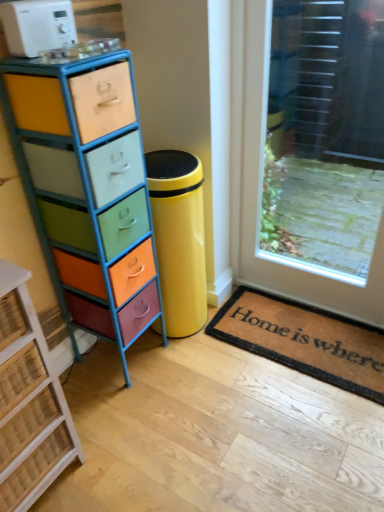
Image resolution: width=384 pixels, height=512 pixels. What do you see at coordinates (87, 189) in the screenshot?
I see `multicolored painted wood chest of drawers at left, which is the 1th chest of drawers from right to left` at bounding box center [87, 189].

This screenshot has width=384, height=512. Find the location of `brown coir mat at lower right`. brown coir mat at lower right is located at coordinates (304, 340).

Describe the element at coordinates (38, 26) in the screenshot. I see `white plastic microwave at upper left` at that location.

You are a GUI agent. You are given a task and a screenshot of the screen. Output one action in this format:
    pyautogui.click(x=<x>, y=<y>)
    Task: Click on the white plastic microwave at upper left
    This screenshot has width=384, height=512.
    Given the screenshot: What is the action you would take?
    pyautogui.click(x=38, y=26)

The width and height of the screenshot is (384, 512). Describe the element at coordinates (260, 203) in the screenshot. I see `transparent glass door at upper right` at that location.

Image resolution: width=384 pixels, height=512 pixels. In order to click on multicolored painted wood chest of drawers at left, which is the 1th chest of drawers from right to left in this screenshot , I will do `click(87, 189)`.

Who is bigger, multicolored painted wood chest of drawers at left, which is the 1th chest of drawers from right to left, or rustic wicker chest of drawers at left, which is the 1th chest of drawers in left-to-right order?

multicolored painted wood chest of drawers at left, which is the 1th chest of drawers from right to left.

Looking at this image, is multicolored painted wood chest of drawers at left, which is the second chest of drawers in left-to-right order, thinner than rustic wicker chest of drawers at left, the second chest of drawers from the right?

Yes, multicolored painted wood chest of drawers at left, which is the second chest of drawers in left-to-right order, is thinner than rustic wicker chest of drawers at left, the second chest of drawers from the right.

Locate an element on the screen. The height and width of the screenshot is (512, 384). the chest of drawers that is above the rustic wicker chest of drawers at left, which is the 1th chest of drawers in left-to-right order (from a real-world perspective) is located at coordinates (87, 189).

Does multicolored painted wood chest of drawers at left, which is the second chest of drawers in left-to-right order, turn towards rustic wicker chest of drawers at left, the second chest of drawers from the right?

No, multicolored painted wood chest of drawers at left, which is the second chest of drawers in left-to-right order, does not turn towards rustic wicker chest of drawers at left, the second chest of drawers from the right.

In the scene shown: Is rustic wicker chest of drawers at left, the second chest of drawers from the right, positioned with its back to white plastic microwave at upper left?

No, rustic wicker chest of drawers at left, the second chest of drawers from the right, is not facing away from white plastic microwave at upper left.

Can you tell me how much rustic wicker chest of drawers at left, the second chest of drawers from the right, and white plastic microwave at upper left differ in facing direction?

rustic wicker chest of drawers at left, the second chest of drawers from the right, and white plastic microwave at upper left are facing 2.54 degrees away from each other.

Is point (7, 489) closer to camera compared to point (62, 8)?

That is True.

From a real-world perspective, which object stands above the other?

In real-world perspective, white plastic microwave at upper left is above.

Is rustic wicker chest of drawers at left, the second chest of drawers from the right, closer to the viewer compared to transparent glass door at upper right?

That is True.

Where is `door above the rustic wicker chest of drawers at left, the second chest of drawers from the right (from the image's perspective)`? door above the rustic wicker chest of drawers at left, the second chest of drawers from the right (from the image's perspective) is located at coordinates (260, 203).

How different are the orientations of rustic wicker chest of drawers at left, which is the 1th chest of drawers in left-to-right order, and transparent glass door at upper right in degrees?

A: rustic wicker chest of drawers at left, which is the 1th chest of drawers in left-to-right order, and transparent glass door at upper right are facing 90.5 degrees away from each other.

Does rustic wicker chest of drawers at left, the second chest of drawers from the right, have a lesser height compared to transparent glass door at upper right?

Yes, rustic wicker chest of drawers at left, the second chest of drawers from the right, is shorter than transparent glass door at upper right.

Can we say white plastic microwave at upper left lies outside brown coir mat at lower right?

Indeed, white plastic microwave at upper left is completely outside brown coir mat at lower right.

Which point is more distant from viewer, (29, 41) or (360, 372)?

The point (360, 372) is farther.

From the image's perspective, which object appears higher, white plastic microwave at upper left or brown coir mat at lower right?

white plastic microwave at upper left is shown above in the image.

Considering the relative sizes of white plastic microwave at upper left and brown coir mat at lower right in the image provided, is white plastic microwave at upper left bigger than brown coir mat at lower right?

Actually, white plastic microwave at upper left might be smaller than brown coir mat at lower right.

Is brown coir mat at lower right facing towards rustic wicker chest of drawers at left, the second chest of drawers from the right?

No, brown coir mat at lower right is not facing towards rustic wicker chest of drawers at left, the second chest of drawers from the right.

Can you confirm if brown coir mat at lower right is wider than rustic wicker chest of drawers at left, which is the 1th chest of drawers in left-to-right order?

No.

Does point (363, 352) come closer to viewer compared to point (38, 340)?

No, it is not.

Consider the image. Is brown coir mat at lower right located outside rustic wicker chest of drawers at left, which is the 1th chest of drawers in left-to-right order?

Indeed, brown coir mat at lower right is completely outside rustic wicker chest of drawers at left, which is the 1th chest of drawers in left-to-right order.

Could you tell me if brown coir mat at lower right is facing white plastic microwave at upper left?

No, brown coir mat at lower right is not facing towards white plastic microwave at upper left.

Which object is wider, brown coir mat at lower right or white plastic microwave at upper left?

Wider between the two is brown coir mat at lower right.

At what (x,y) coordinates should I click in order to perform the action: click on doormat to the right of white plastic microwave at upper left. Please return your answer as a coordinate pair (x, y). The height and width of the screenshot is (512, 384). Looking at the image, I should click on (304, 340).

Considering the relative positions of brown coir mat at lower right and white plastic microwave at upper left in the image provided, is brown coir mat at lower right to the left of white plastic microwave at upper left from the viewer's perspective?

Incorrect, brown coir mat at lower right is not on the left side of white plastic microwave at upper left.

From the image's perspective, is white plastic microwave at upper left above multicolored painted wood chest of drawers at left, which is the 1th chest of drawers from right to left?

Yes, from the image's perspective, white plastic microwave at upper left is above multicolored painted wood chest of drawers at left, which is the 1th chest of drawers from right to left.

Is white plastic microwave at upper left next to multicolored painted wood chest of drawers at left, which is the second chest of drawers in left-to-right order, and touching it?

white plastic microwave at upper left is not next to multicolored painted wood chest of drawers at left, which is the second chest of drawers in left-to-right order, and they're not touching.

Is white plastic microwave at upper left to the right of multicolored painted wood chest of drawers at left, which is the second chest of drawers in left-to-right order, from the viewer's perspective?

No.

At what (x,y) coordinates should I click in order to perform the action: click on chest of drawers on the left of multicolored painted wood chest of drawers at left, which is the second chest of drawers in left-to-right order. Please return your answer as a coordinate pair (x, y). Looking at the image, I should click on (29, 402).

This screenshot has width=384, height=512. Find the location of `appliance lying above the rustic wicker chest of drawers at left, the second chest of drawers from the right (from the image's perspective)`. appliance lying above the rustic wicker chest of drawers at left, the second chest of drawers from the right (from the image's perspective) is located at coordinates (38, 26).

From the image, which object appears to be nearer to rustic wicker chest of drawers at left, the second chest of drawers from the right, white plastic microwave at upper left or multicolored painted wood chest of drawers at left, which is the second chest of drawers in left-to-right order?

Among the two, multicolored painted wood chest of drawers at left, which is the second chest of drawers in left-to-right order, is located nearer to rustic wicker chest of drawers at left, the second chest of drawers from the right.

When comparing their distances from transparent glass door at upper right, does brown coir mat at lower right or white plastic microwave at upper left seem closer?

brown coir mat at lower right is closer to transparent glass door at upper right.

Looking at the image, which one is located further to white plastic microwave at upper left, transparent glass door at upper right or rustic wicker chest of drawers at left, which is the 1th chest of drawers in left-to-right order?

Based on the image, transparent glass door at upper right appears to be further to white plastic microwave at upper left.

Which object lies nearer to the anchor point transparent glass door at upper right, white plastic microwave at upper left or multicolored painted wood chest of drawers at left, which is the 1th chest of drawers from right to left?

multicolored painted wood chest of drawers at left, which is the 1th chest of drawers from right to left, is positioned closer to the anchor transparent glass door at upper right.

When comparing their distances from transparent glass door at upper right, does rustic wicker chest of drawers at left, which is the 1th chest of drawers in left-to-right order, or white plastic microwave at upper left seem closer?

white plastic microwave at upper left.

Based on their spatial positions, is rustic wicker chest of drawers at left, the second chest of drawers from the right, or white plastic microwave at upper left closer to multicolored painted wood chest of drawers at left, which is the 1th chest of drawers from right to left?

white plastic microwave at upper left is closer to multicolored painted wood chest of drawers at left, which is the 1th chest of drawers from right to left.

From the image, which object appears to be farther from white plastic microwave at upper left, brown coir mat at lower right or transparent glass door at upper right?

brown coir mat at lower right lies further to white plastic microwave at upper left than the other object.

Which object lies further to the anchor point rustic wicker chest of drawers at left, which is the 1th chest of drawers in left-to-right order, white plastic microwave at upper left or brown coir mat at lower right?

Among the two, brown coir mat at lower right is located further to rustic wicker chest of drawers at left, which is the 1th chest of drawers in left-to-right order.

At what (x,y) coordinates should I click in order to perform the action: click on doormat situated between multicolored painted wood chest of drawers at left, which is the second chest of drawers in left-to-right order, and transparent glass door at upper right from left to right. Please return your answer as a coordinate pair (x, y). Looking at the image, I should click on (304, 340).

The width and height of the screenshot is (384, 512). I want to click on the chest of drawers that lies between white plastic microwave at upper left and brown coir mat at lower right from top to bottom, so click(x=87, y=189).

The width and height of the screenshot is (384, 512). I want to click on chest of drawers between rustic wicker chest of drawers at left, the second chest of drawers from the right, and transparent glass door at upper right, in the horizontal direction, so click(87, 189).

At what (x,y) coordinates should I click in order to perform the action: click on the chest of drawers between white plastic microwave at upper left and rustic wicker chest of drawers at left, the second chest of drawers from the right, vertically. Please return your answer as a coordinate pair (x, y). The width and height of the screenshot is (384, 512). Looking at the image, I should click on (87, 189).